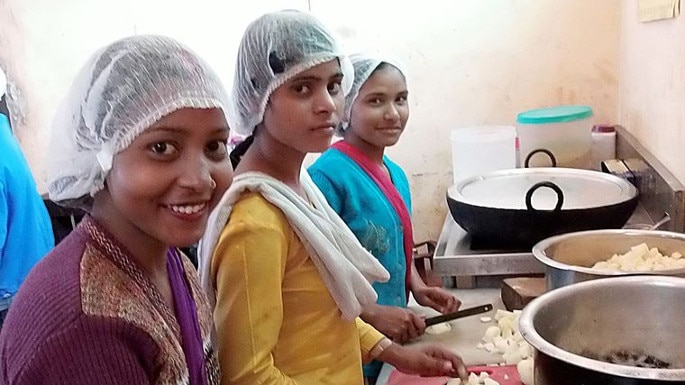
This screenshot has height=385, width=685. I want to click on canister lid, so click(569, 110).